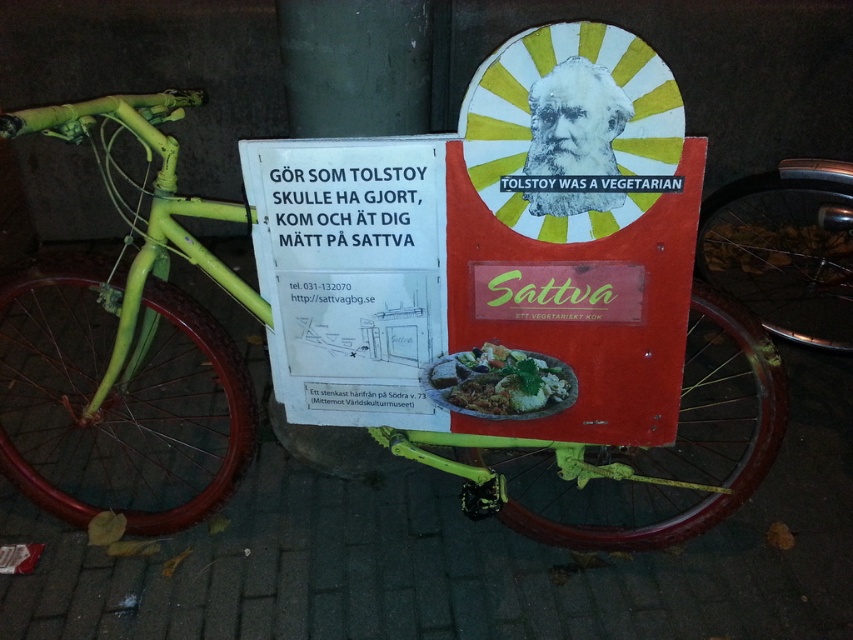
Question: Which object is positioned farthest from the matte brown plate at center?

Choices:
 (A) shiny metallic bicycle wheel at lower right
 (B) green matte bicycle at left

Answer: (A)

Question: Which of the following is the closest to the observer?

Choices:
 (A) (171, 186)
 (B) (490, 403)
 (C) (755, 211)

Answer: (B)

Question: Does green matte bicycle at left appear over matte brown plate at center?

Choices:
 (A) yes
 (B) no

Answer: (A)

Question: Does shiny metallic bicycle wheel at lower right lie behind matte brown plate at center?

Choices:
 (A) yes
 (B) no

Answer: (A)

Question: Which object is positioned farthest from the shiny metallic bicycle wheel at lower right?

Choices:
 (A) matte brown plate at center
 (B) green matte bicycle at left

Answer: (B)

Question: Can you confirm if shiny metallic bicycle wheel at lower right is wider than matte brown plate at center?

Choices:
 (A) yes
 (B) no

Answer: (A)